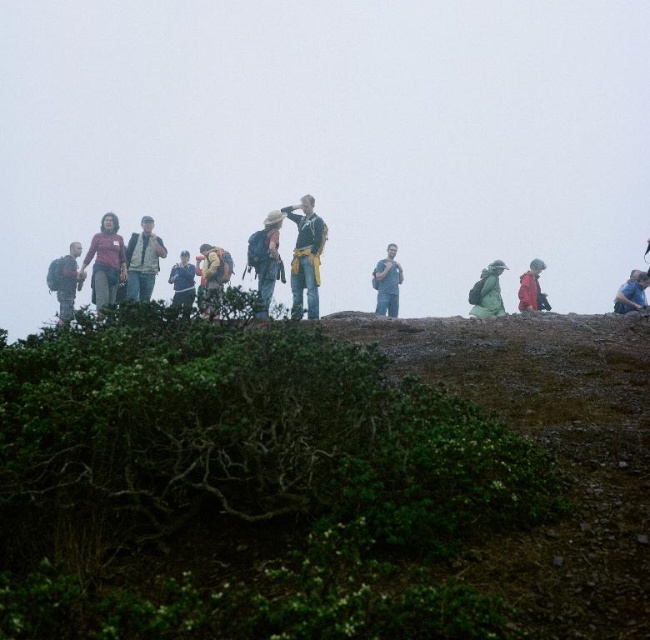
You are standing at the base of the rocky outcrop and want to reach the green leafy bush at center. Given that the coordinates of your current position are at point 0.0, 0.0, what is the direction you should move in to reach the bush?

The green leafy bush at center is located at coordinates (356, 452), so you should move in the positive x and y direction to reach it.